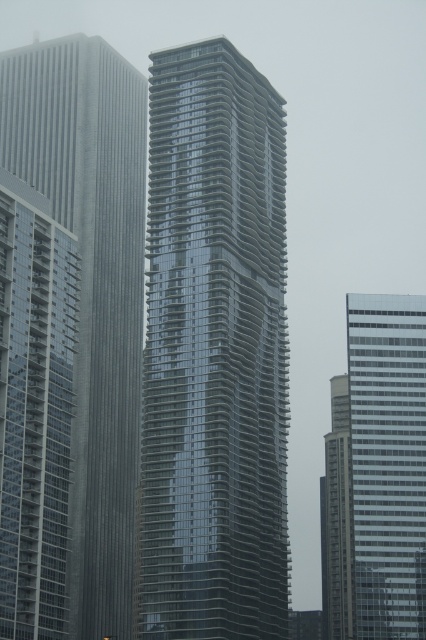
Question: Which point is farther from the camera taking this photo?

Choices:
 (A) (331, 563)
 (B) (201, 394)
 (C) (46, 269)

Answer: (A)

Question: Observing the image, what is the correct spatial positioning of reflective glass skyscraper at left in reference to clear glass skyscraper at right?

Choices:
 (A) above
 (B) below

Answer: (A)

Question: Which point appears farthest from the camera in this image?

Choices:
 (A) (74, 276)
 (B) (106, 532)

Answer: (B)

Question: Does reflective glass skyscraper at left have a lesser width compared to clear glass skyscraper at right?

Choices:
 (A) yes
 (B) no

Answer: (B)

Question: In this image, where is metallic glass building at left located relative to clear glass skyscraper at right?

Choices:
 (A) below
 (B) above

Answer: (B)

Question: Which point is farther from the camera taking this photo?

Choices:
 (A) (28, 426)
 (B) (353, 326)
 (C) (137, 168)

Answer: (C)